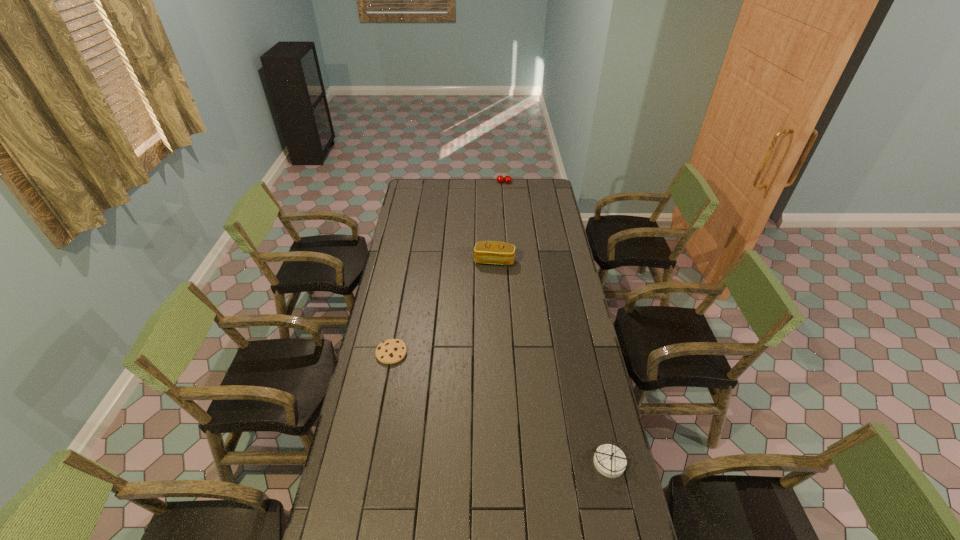
The height and width of the screenshot is (540, 960). I want to click on vacant space on the desktop that is between the cookie and the rightmost object and is positioned with the stems of the tallest object pointing upwards, so click(x=492, y=403).

At what (x,y) coordinates should I click in order to perform the action: click on vacant space on the desktop that is between the leftmost object and the third tallest object and is positioned on the zipper side of the clutch bag. Please return your answer as a coordinate pair (x, y). The height and width of the screenshot is (540, 960). Looking at the image, I should click on (462, 389).